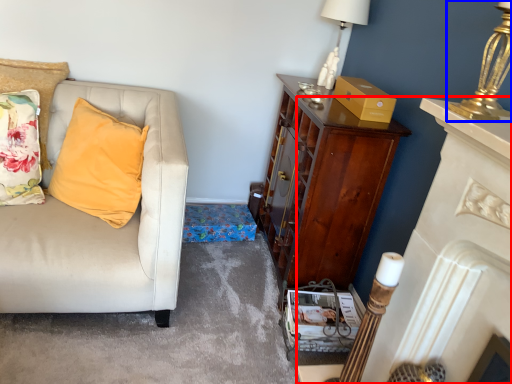
Question: Which point is further to the camera, fireplace (highlighted by a red box) or lamp (highlighted by a blue box)?

Choices:
 (A) fireplace
 (B) lamp

Answer: (B)